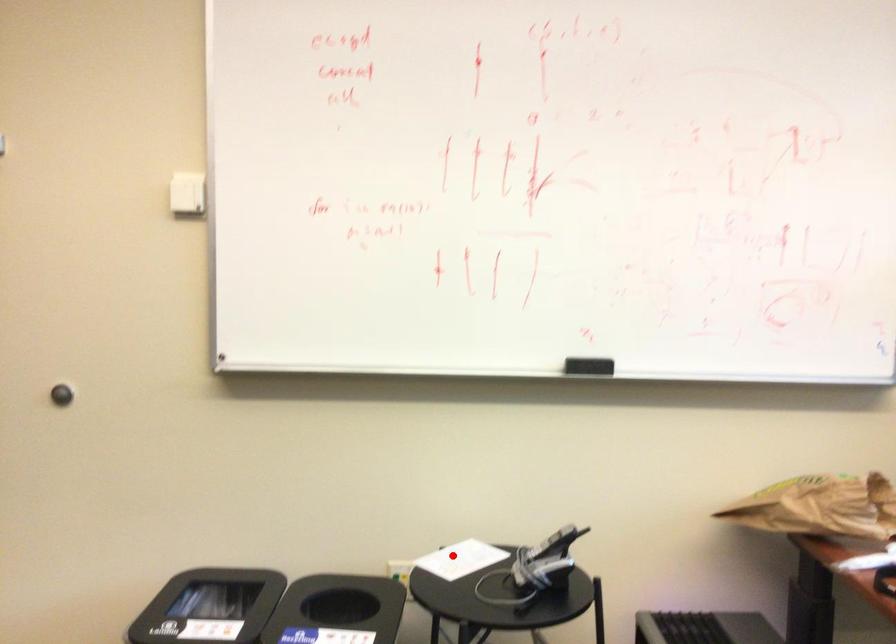
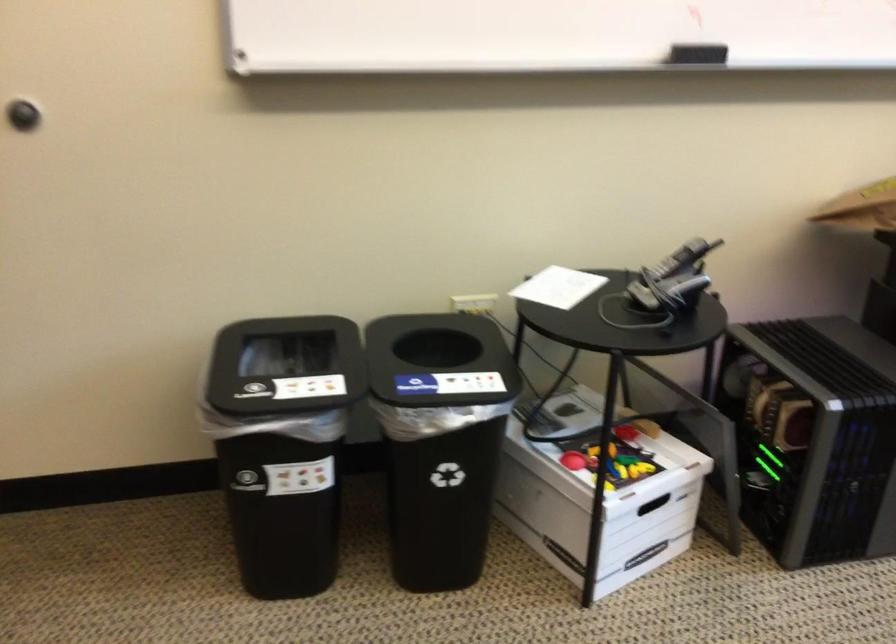
Question: I am providing you with two images of the same scene from different viewpoints. Image1 has a red point marked. In image2, the corresponding 3D location appears at what relative position? Reply with the corresponding letter.

Choices:
 (A) Closer
 (B) Farther

Answer: (A)